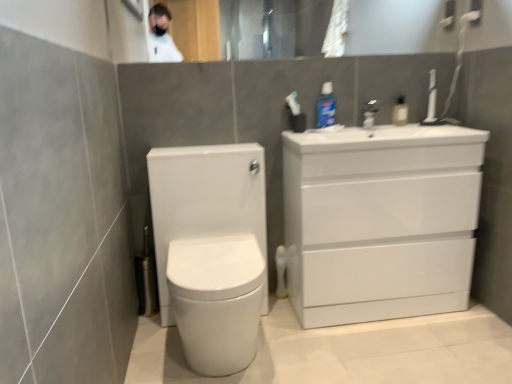
Question: Is glossy glass mirror at upper center with clear plastic bottle at upper center, which is the 1th toiletry in right-to-left order?

Choices:
 (A) yes
 (B) no

Answer: (B)

Question: Can you confirm if glossy glass mirror at upper center is shorter than clear plastic bottle at upper center, which is the 1th toiletry in right-to-left order?

Choices:
 (A) yes
 (B) no

Answer: (B)

Question: Is glossy glass mirror at upper center completely or partially outside of clear plastic bottle at upper center, which is the 1th toiletry in right-to-left order?

Choices:
 (A) no
 (B) yes

Answer: (B)

Question: Does glossy glass mirror at upper center appear on the left side of clear plastic bottle at upper center, the 2th toiletry in the left-to-right sequence?

Choices:
 (A) no
 (B) yes

Answer: (B)

Question: Is glossy glass mirror at upper center bigger than clear plastic bottle at upper center, which is the 1th toiletry in right-to-left order?

Choices:
 (A) yes
 (B) no

Answer: (A)

Question: From a real-world perspective, is glossy glass mirror at upper center above or below white glossy cabinet at right?

Choices:
 (A) below
 (B) above

Answer: (B)

Question: Considering the positions of glossy glass mirror at upper center and white glossy cabinet at right in the image, is glossy glass mirror at upper center taller or shorter than white glossy cabinet at right?

Choices:
 (A) short
 (B) tall

Answer: (A)

Question: Does point (364, 51) appear closer or farther from the camera than point (352, 236)?

Choices:
 (A) farther
 (B) closer

Answer: (A)

Question: From the image's perspective, is glossy glass mirror at upper center located above or below white glossy cabinet at right?

Choices:
 (A) above
 (B) below

Answer: (A)

Question: Considering the relative positions of satin nickel faucet at upper center and glossy glass mirror at upper center in the image provided, is satin nickel faucet at upper center to the left or to the right of glossy glass mirror at upper center?

Choices:
 (A) right
 (B) left

Answer: (A)

Question: From the image's perspective, is satin nickel faucet at upper center positioned above or below glossy glass mirror at upper center?

Choices:
 (A) below
 (B) above

Answer: (A)

Question: Considering their positions, is satin nickel faucet at upper center located in front of or behind glossy glass mirror at upper center?

Choices:
 (A) front
 (B) behind

Answer: (B)

Question: Is point (373, 109) positioned closer to the camera than point (418, 34)?

Choices:
 (A) farther
 (B) closer

Answer: (B)

Question: Looking at their shapes, would you say clear plastic bottle at upper center, the 2th toiletry in the left-to-right sequence, is wider or thinner than white glossy toilet at center?

Choices:
 (A) wide
 (B) thin

Answer: (B)

Question: Considering the positions of clear plastic bottle at upper center, which is the 1th toiletry in right-to-left order, and white glossy toilet at center in the image, is clear plastic bottle at upper center, which is the 1th toiletry in right-to-left order, bigger or smaller than white glossy toilet at center?

Choices:
 (A) small
 (B) big

Answer: (A)